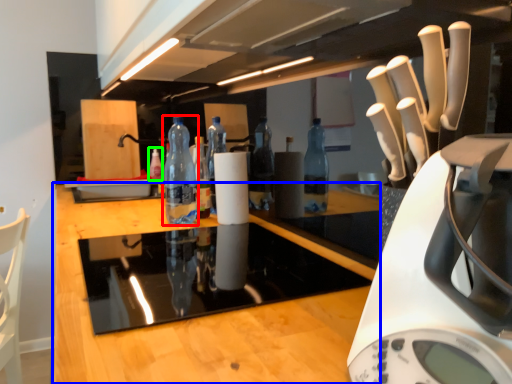
Question: Which object is the farthest from bottle (highlighted by a red box)? Choose among these: countertop (highlighted by a blue box) or bottle (highlighted by a green box).

Choices:
 (A) countertop
 (B) bottle

Answer: (B)